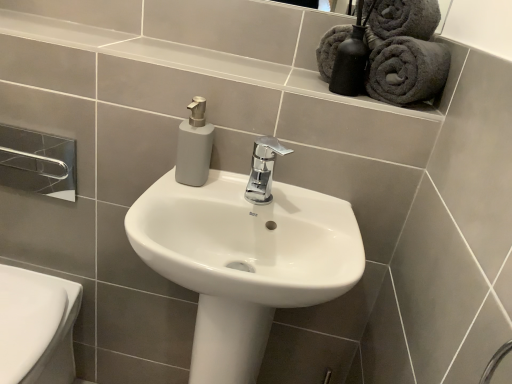
Question: Does white glossy bidet at lower left have a smaller size compared to dark grey plush bath towel at upper right, the 2th bath towel when ordered from right to left?

Choices:
 (A) yes
 (B) no

Answer: (B)

Question: Does white glossy bidet at lower left have a greater height compared to dark grey plush bath towel at upper right, the 2th bath towel positioned from the left?

Choices:
 (A) yes
 (B) no

Answer: (A)

Question: Is white glossy bidet at lower left to the left of dark grey plush bath towel at upper right, the 2th bath towel positioned from the left, from the viewer's perspective?

Choices:
 (A) yes
 (B) no

Answer: (A)

Question: Is white glossy bidet at lower left facing away from dark grey plush bath towel at upper right, the 2th bath towel when ordered from right to left?

Choices:
 (A) no
 (B) yes

Answer: (A)

Question: Is dark grey plush bath towel at upper right, the 2th bath towel positioned from the left, surrounded by white glossy bidet at lower left?

Choices:
 (A) no
 (B) yes

Answer: (A)

Question: Is white glossy bidet at lower left in contact with dark grey plush bath towel at upper right, the 2th bath towel when ordered from right to left?

Choices:
 (A) no
 (B) yes

Answer: (A)

Question: Is white glossy sink at center wider than dark gray plush towel at upper right, which is counted as the third bath towel, starting from the left?

Choices:
 (A) no
 (B) yes

Answer: (B)

Question: From a real-world perspective, is white glossy sink at center positioned under dark gray plush towel at upper right, which is counted as the third bath towel, starting from the left, based on gravity?

Choices:
 (A) no
 (B) yes

Answer: (B)

Question: Would you say white glossy sink at center contains dark gray plush towel at upper right, which ranks as the 1th bath towel in right-to-left order?

Choices:
 (A) no
 (B) yes

Answer: (A)

Question: Is white glossy sink at center positioned far away from dark gray plush towel at upper right, which is counted as the third bath towel, starting from the left?

Choices:
 (A) no
 (B) yes

Answer: (A)

Question: Does white glossy sink at center have a smaller size compared to dark gray plush towel at upper right, which ranks as the 1th bath towel in right-to-left order?

Choices:
 (A) no
 (B) yes

Answer: (A)

Question: From a real-world perspective, is white glossy sink at center over dark gray plush towel at upper right, which is counted as the third bath towel, starting from the left?

Choices:
 (A) no
 (B) yes

Answer: (A)

Question: Is dark grey plush bath towel at upper right, the 2th bath towel when ordered from right to left, positioned before gray matte tile at lower right?

Choices:
 (A) no
 (B) yes

Answer: (A)